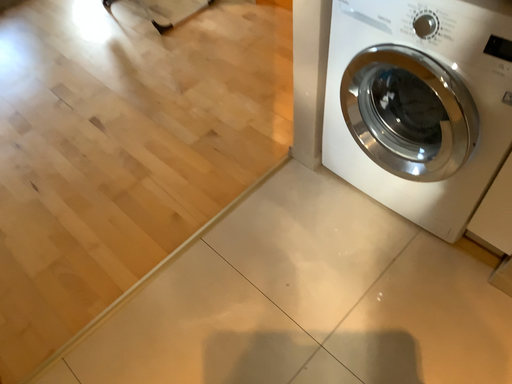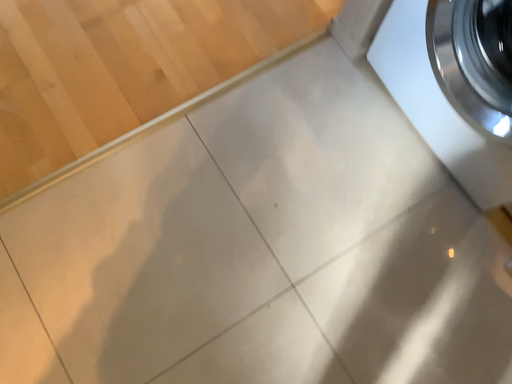
Question: Which way did the camera rotate in the video?

Choices:
 (A) rotated upward
 (B) rotated downward

Answer: (B)